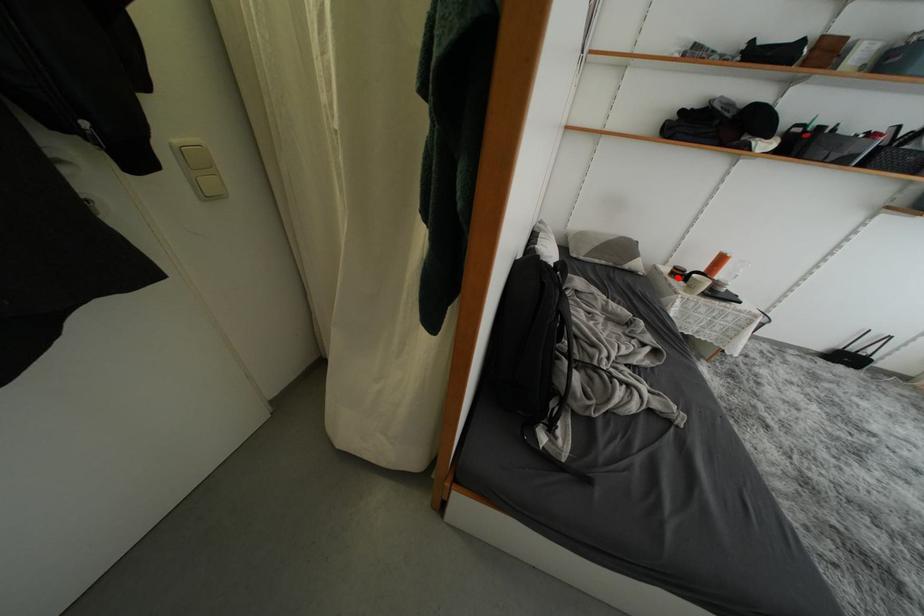
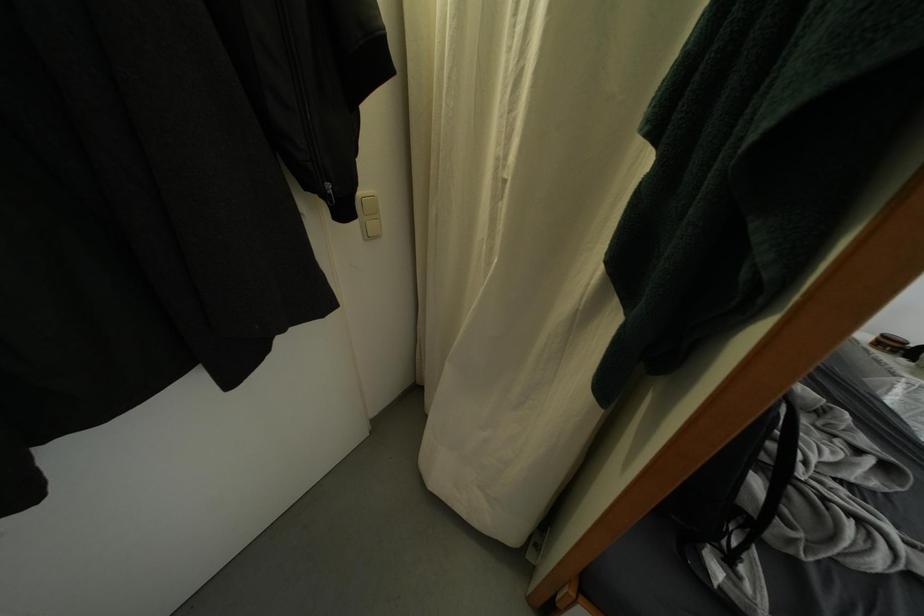
The point at the highlighted location is marked in the first image. Where is the corresponding point in the second image?

(884, 347)